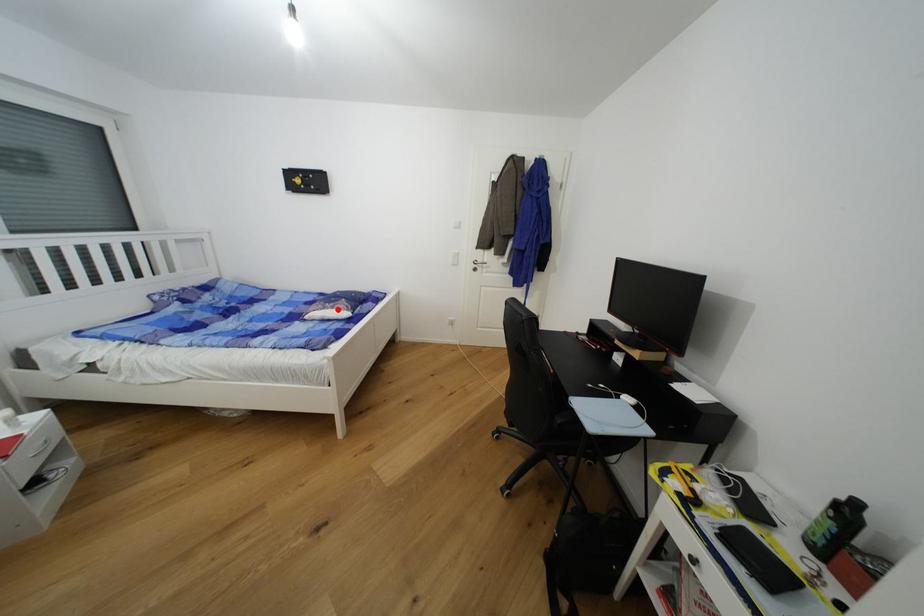
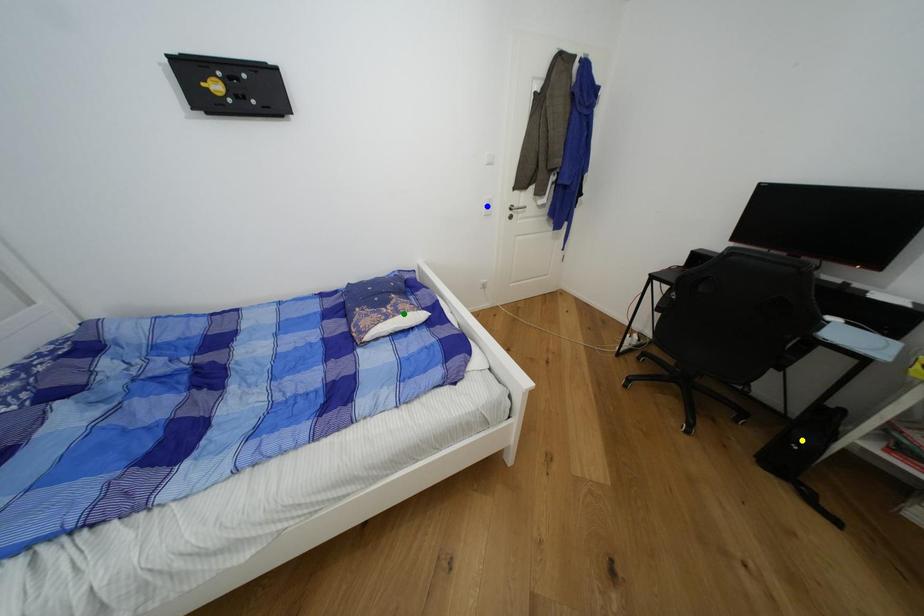
Question: I am providing you with two images of the same scene from different viewpoints. A red point is marked on the first image. You are given multiple points on the second image. Which point in image 2 is actually the same real-world point as the red point in image 1?

Choices:
 (A) green point
 (B) yellow point
 (C) blue point

Answer: (A)